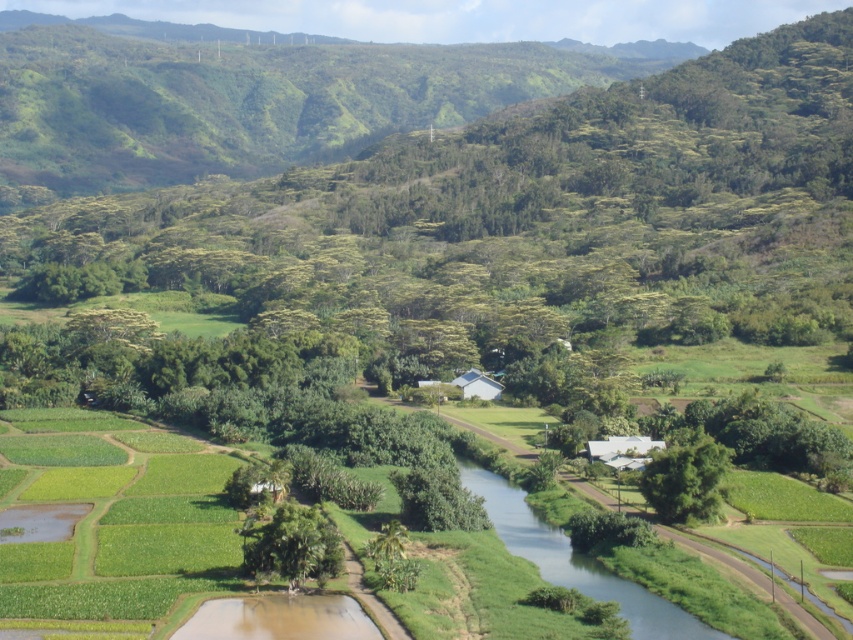
Question: Is green grassy stream at center to the right of green leafy tree at center-right from the viewer's perspective?

Choices:
 (A) no
 (B) yes

Answer: (A)

Question: Which of these objects is positioned closest to the green leafy tree at center-right?

Choices:
 (A) green grassy stream at center
 (B) green leafy tree at center

Answer: (A)

Question: Is green grassy stream at center thinner than green leafy tree at center-right?

Choices:
 (A) no
 (B) yes

Answer: (A)

Question: Estimate the real-world distances between objects in this image. Which object is closer to the green leafy tree at center-right?

Choices:
 (A) green leafy tree at center
 (B) green grassy stream at center

Answer: (B)

Question: Is green leafy tree at center positioned behind green leafy tree at center-right?

Choices:
 (A) no
 (B) yes

Answer: (A)

Question: Which object appears closest to the camera in this image?

Choices:
 (A) green leafy tree at center
 (B) green leafy tree at center-right
 (C) green grassy stream at center

Answer: (C)